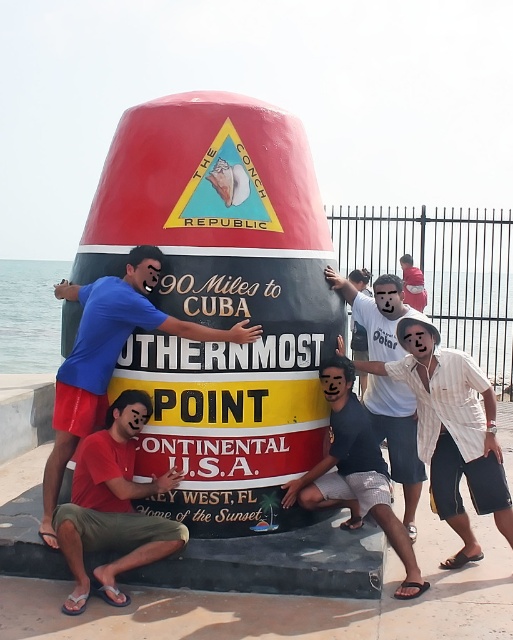
You are a tourist visiting Key West and see the monument with a white striped shirt at center and matte black shorts at lower center. Which item is positioned higher up on the monument?

The white striped shirt at center is located above the matte black shorts at lower center on the monument.